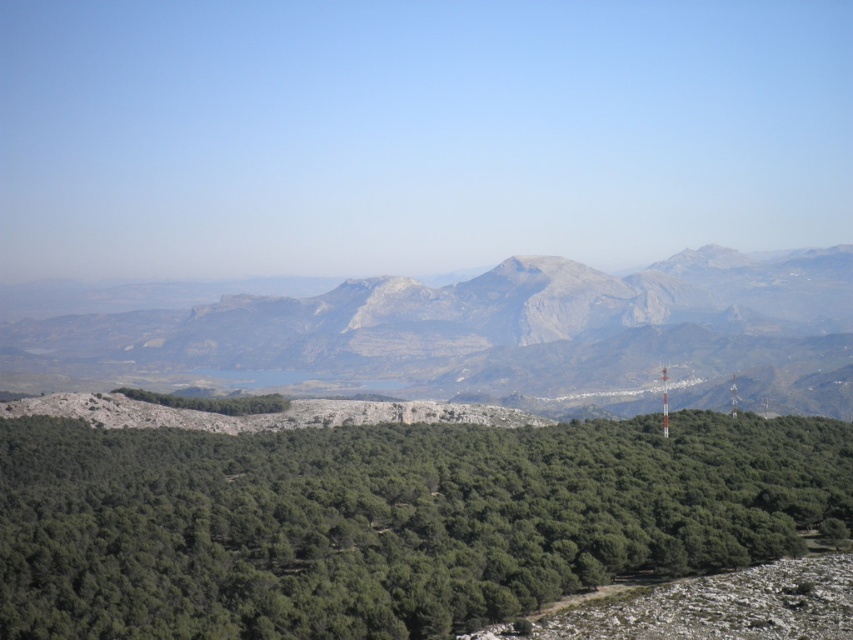
Does green leafy trees at center have a greater height compared to rugged stone mountain range at center?

No.

Which is more to the right, green leafy trees at center or rugged stone mountain range at center?

Positioned to the right is rugged stone mountain range at center.

Does point (793, 452) lie behind point (694, 285)?

No, (793, 452) is closer to viewer.

Locate an element on the screen. The image size is (853, 640). green leafy trees at center is located at coordinates (387, 520).